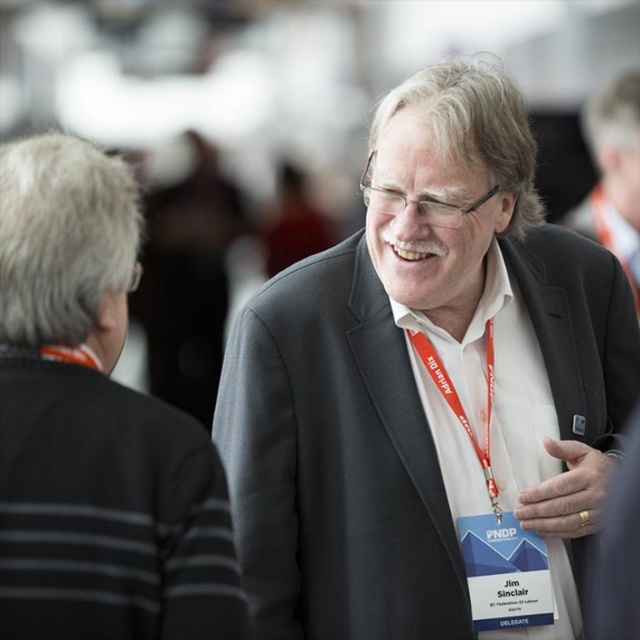
How distant is gray suit at center from dark gray suit at center?

They are 60.56 centimeters apart.

Can you confirm if gray suit at center is positioned to the right of dark gray suit at center?

Correct, you'll find gray suit at center to the right of dark gray suit at center.

Does point (572, 353) come closer to viewer compared to point (216, 481)?

No, (572, 353) is further to viewer.

This screenshot has width=640, height=640. I want to click on gray suit at center, so click(426, 381).